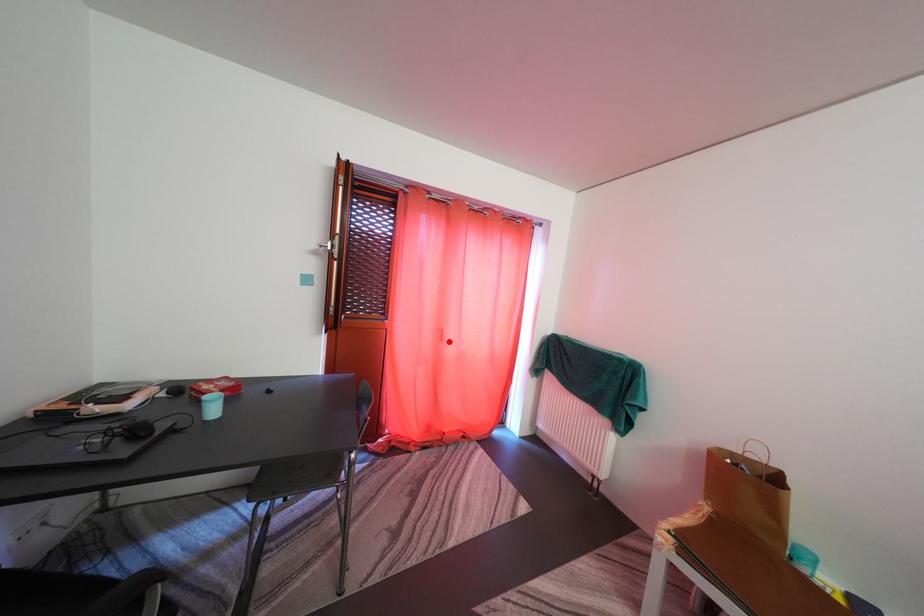
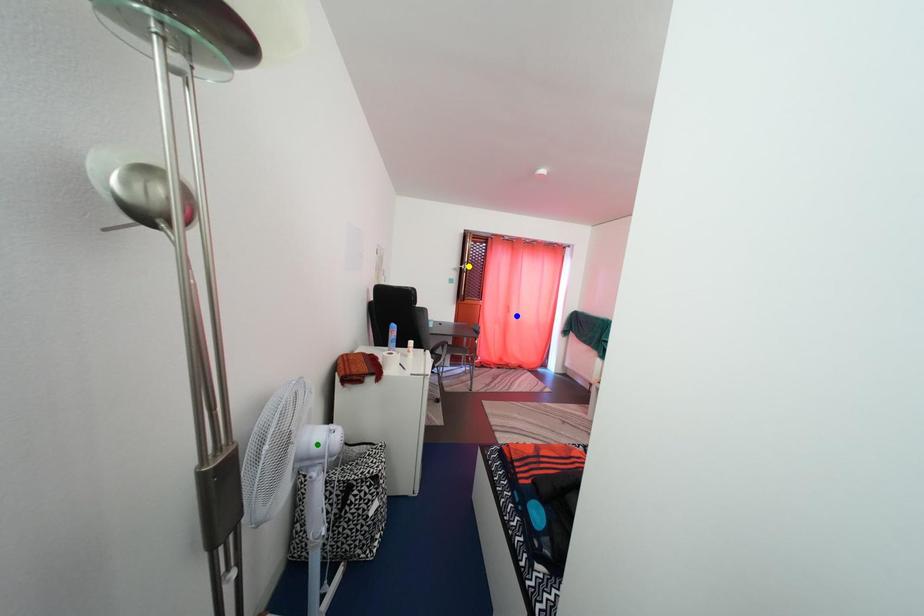
Question: I am providing you with two images of the same scene from different viewpoints. A red point is marked on the first image. You are given multiple points on the second image. Which point in image 2 is actually the same real-world point as the red point in image 1?

Choices:
 (A) blue point
 (B) green point
 (C) yellow point

Answer: (A)